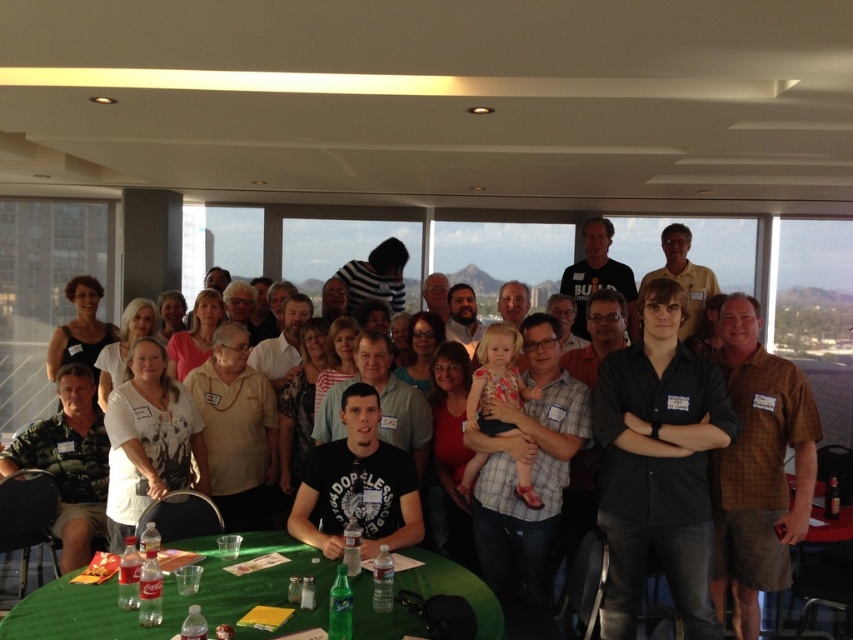
Question: Among these objects, which one is farthest from the camera?

Choices:
 (A) black matte shirt at center
 (B) brown plaid shirt at right

Answer: (B)

Question: Is black matte shirt at center further to camera compared to brown plaid shirt at right?

Choices:
 (A) yes
 (B) no

Answer: (B)

Question: Which object appears farthest from the camera in this image?

Choices:
 (A) green fabric table at lower center
 (B) black matte shirt at center
 (C) brown plaid shirt at right

Answer: (C)

Question: Can you confirm if black matte shirt at center is wider than brown plaid shirt at right?

Choices:
 (A) no
 (B) yes

Answer: (B)

Question: Which of these objects is positioned farthest from the black matte shirt at center?

Choices:
 (A) green fabric table at lower center
 (B) brown plaid shirt at right

Answer: (A)

Question: In this image, where is brown plaid shirt at right located relative to green fabric table at lower center?

Choices:
 (A) right
 (B) left

Answer: (A)